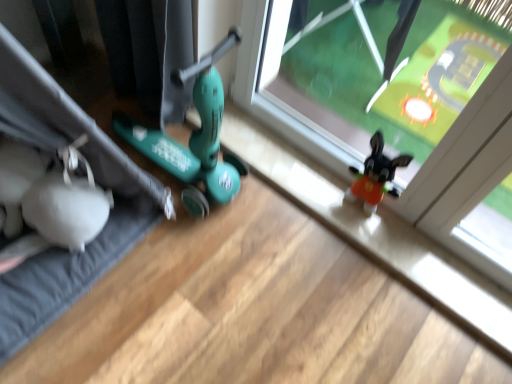
Question: From the image's perspective, is white fabric yoga mat at left on top of transparent plastic window at center?

Choices:
 (A) yes
 (B) no

Answer: (B)

Question: Does white fabric yoga mat at left have a larger size compared to transparent plastic window at center?

Choices:
 (A) yes
 (B) no

Answer: (A)

Question: From the image's perspective, is white fabric yoga mat at left located beneath transparent plastic window at center?

Choices:
 (A) no
 (B) yes

Answer: (B)

Question: Would you say white fabric yoga mat at left is a long distance from transparent plastic window at center?

Choices:
 (A) yes
 (B) no

Answer: (B)

Question: Is white fabric yoga mat at left completely or partially outside of transparent plastic window at center?

Choices:
 (A) no
 (B) yes

Answer: (B)

Question: From a real-world perspective, is white fabric yoga mat at left on transparent plastic window at center?

Choices:
 (A) yes
 (B) no

Answer: (A)

Question: Does transparent plastic window at center appear on the right side of white fabric yoga mat at left?

Choices:
 (A) no
 (B) yes

Answer: (B)

Question: Could white fabric yoga mat at left be considered to be inside transparent plastic window at center?

Choices:
 (A) yes
 (B) no

Answer: (B)

Question: Is transparent plastic window at center aimed at white fabric yoga mat at left?

Choices:
 (A) yes
 (B) no

Answer: (A)

Question: From the image's perspective, is transparent plastic window at center below white fabric yoga mat at left?

Choices:
 (A) no
 (B) yes

Answer: (A)

Question: Is transparent plastic window at center touching white fabric yoga mat at left?

Choices:
 (A) no
 (B) yes

Answer: (A)

Question: Does transparent plastic window at center have a greater height compared to white fabric yoga mat at left?

Choices:
 (A) no
 (B) yes

Answer: (A)

Question: Based on their sizes in the image, would you say transparent plastic window at center is bigger or smaller than white fabric yoga mat at left?

Choices:
 (A) small
 (B) big

Answer: (A)